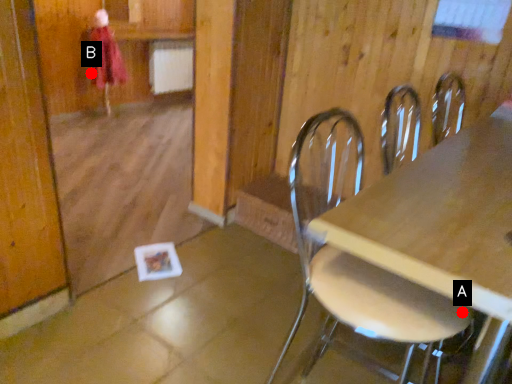
Question: Two points are circled on the image, labeled by A and B beside each circle. Which point appears closest to the camera in this image?

Choices:
 (A) A is closer
 (B) B is closer

Answer: (A)